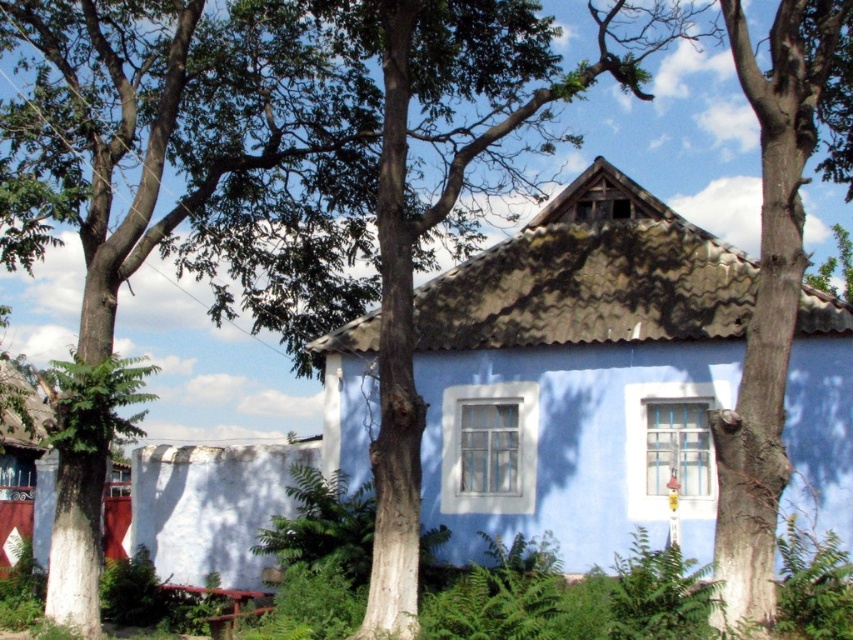
You are standing in front of the house and notice two white structures. One is the white rough wall at lower left and the other is the white painted wood hut at left. Which one is shorter in height?

The white rough wall at lower left is shorter in height compared to the white painted wood hut at left.

You are standing in front of the rustic house and notice two points marked on the image. The first point is at coordinate point (335, 356) and the second is at coordinate point (207, 541). Which point is closer to you?

Point (335, 356) is in front of point (207, 541), so the first point is closer to you.

You are standing at the origin point of the coordinate system in the image. You want to walk towards the blue corrugated metal hut at center. Which direction should you move in terms of the coordinate system?

The blue corrugated metal hut at center is located at point 0.586 on the x axis and 0.681 on the y axis. Since you are at the origin, you should move towards the positive x and positive y direction to reach it.